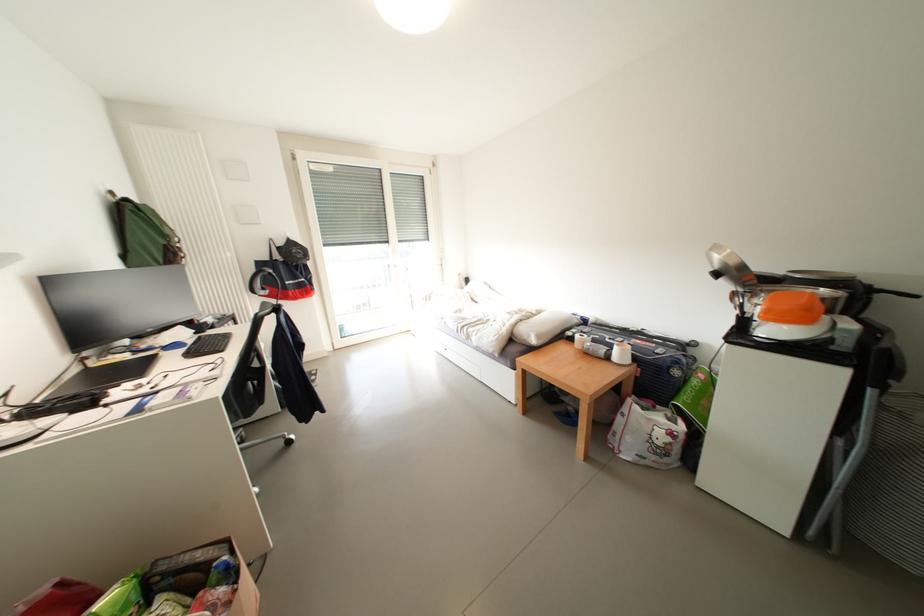
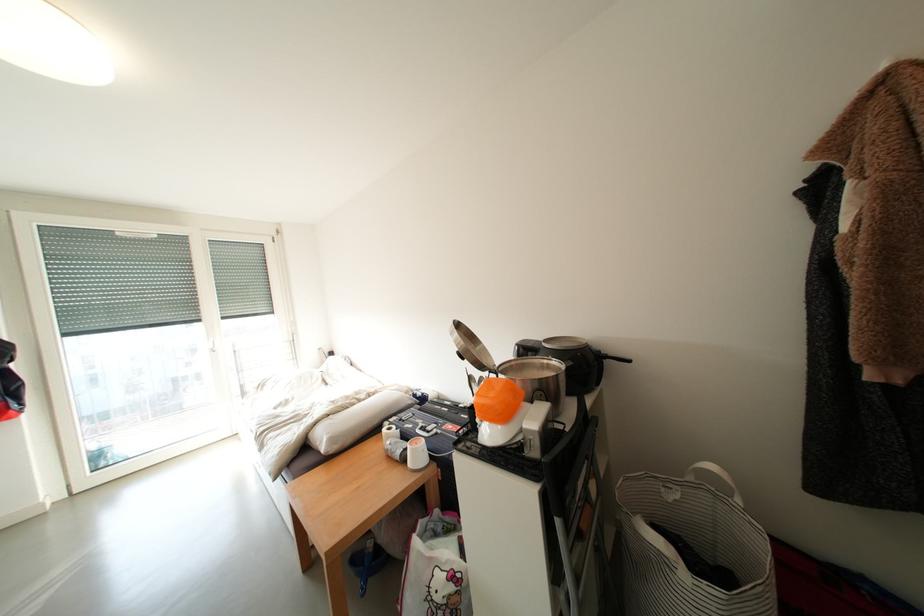
Locate, in the second image, the point that corresponds to point (566, 334) in the first image.

(383, 426)